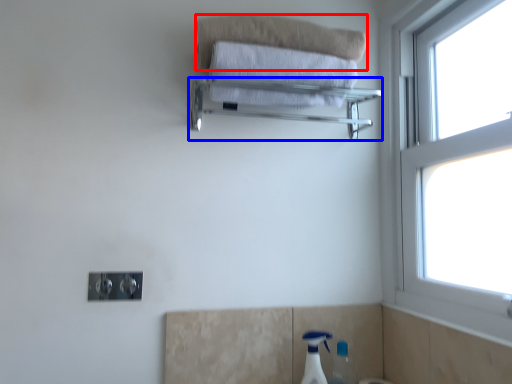
Question: Which of the following is the farthest to the observer, bath towel (highlighted by a red box) or balustrade (highlighted by a blue box)?

Choices:
 (A) bath towel
 (B) balustrade

Answer: (A)